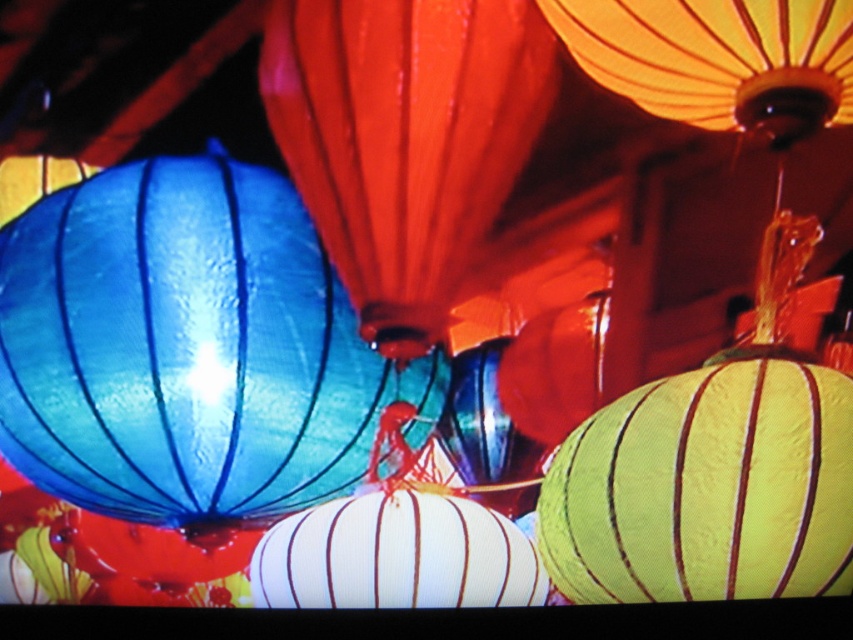
Question: Based on their relative distances, which object is farther from the matte yellow paper lantern at lower right?

Choices:
 (A) matte blue paper lantern at left
 (B) matte orange paper lantern at upper right
 (C) matte orange paper lantern at center

Answer: (B)

Question: Which point is closer to the camera taking this photo?

Choices:
 (A) (262, 253)
 (B) (560, 12)
 (C) (717, 394)

Answer: (B)

Question: Can you confirm if matte blue paper lantern at left is smaller than matte orange paper lantern at center?

Choices:
 (A) no
 (B) yes

Answer: (A)

Question: Does matte yellow paper lantern at lower right have a larger size compared to matte orange paper lantern at upper right?

Choices:
 (A) yes
 (B) no

Answer: (A)

Question: Which point is closer to the camera?

Choices:
 (A) matte blue paper lantern at left
 (B) matte orange paper lantern at center

Answer: (B)

Question: Can you confirm if matte blue paper lantern at left is thinner than matte orange paper lantern at upper right?

Choices:
 (A) no
 (B) yes

Answer: (A)